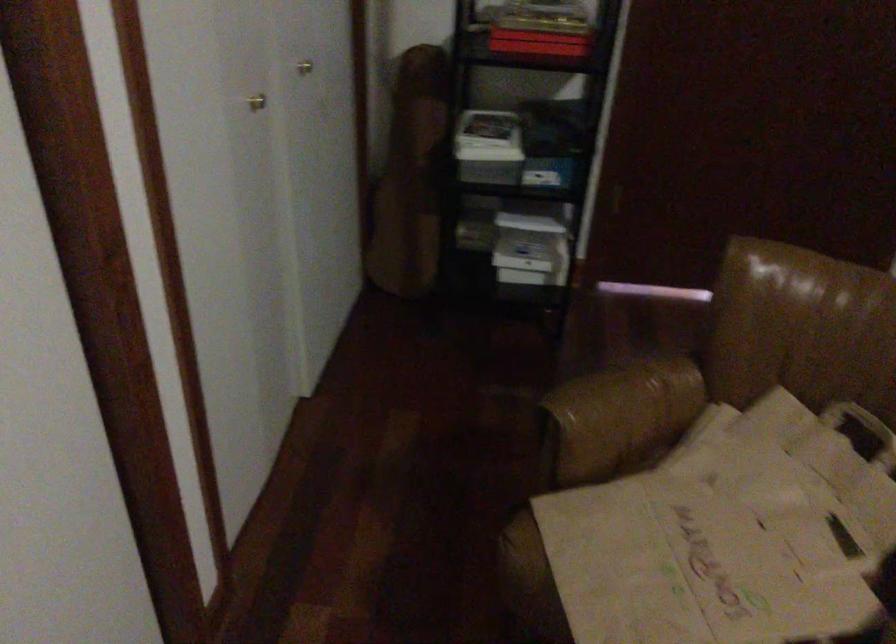
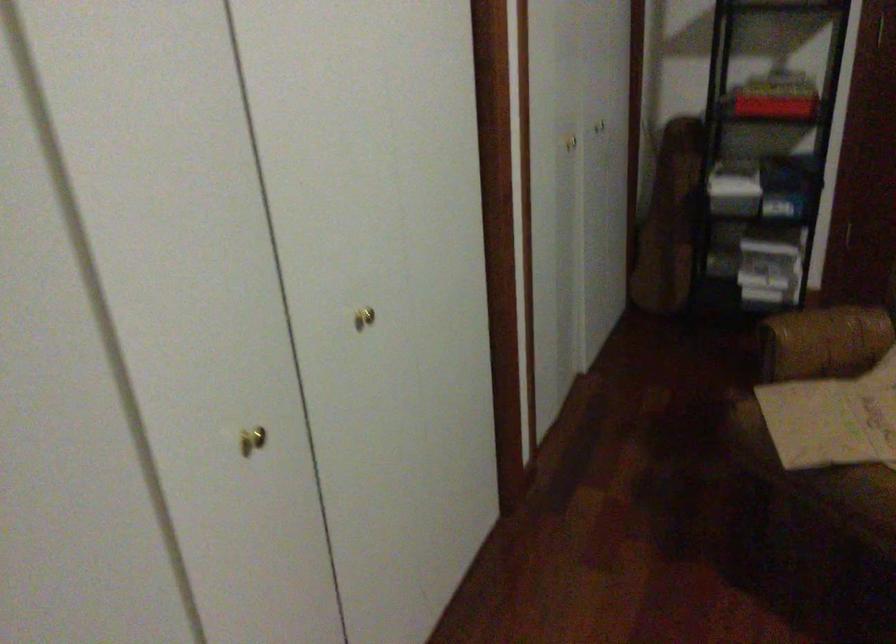
Question: What movement of the cameraman would produce the second image?

Choices:
 (A) Left
 (B) Right
 (C) Forward
 (D) Backward

Answer: (D)